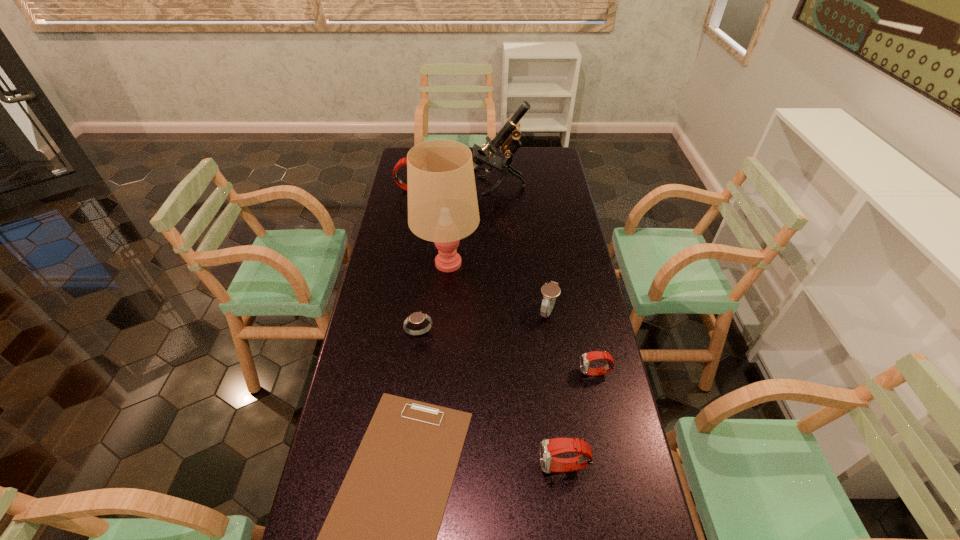
Locate an element on the screen. This screenshot has height=540, width=960. lampshade is located at coordinates pos(442,200).

Locate an element on the screen. Image resolution: width=960 pixels, height=540 pixels. pink lampshade is located at coordinates (442, 200).

The width and height of the screenshot is (960, 540). Find the location of `microscope`. microscope is located at coordinates (507, 139).

Identify the location of the tallest watch. (403, 161).

You are a GUI agent. You are given a task and a screenshot of the screen. Output one action in this format:
    pyautogui.click(x=<x>, y=<y>)
    Task: Click on the farthest red watch
    
    Given the screenshot: What is the action you would take?
    pyautogui.click(x=403, y=161)

Find the location of a particular element. This screenshot has width=960, height=540. the second biggest red watch is located at coordinates (548, 447).

Where is `the nearest watch`? The height and width of the screenshot is (540, 960). the nearest watch is located at coordinates (548, 447).

Image resolution: width=960 pixels, height=540 pixels. Identify the location of the farther gray watch. [x=550, y=291].

This screenshot has height=540, width=960. In order to click on the right gray watch in this screenshot , I will do `click(550, 291)`.

You are a GUI agent. You are given a task and a screenshot of the screen. Output one action in this format:
    pyautogui.click(x=<x>, y=<y>)
    Task: Click on the second farthest red watch
    
    Given the screenshot: What is the action you would take?
    pyautogui.click(x=586, y=358)